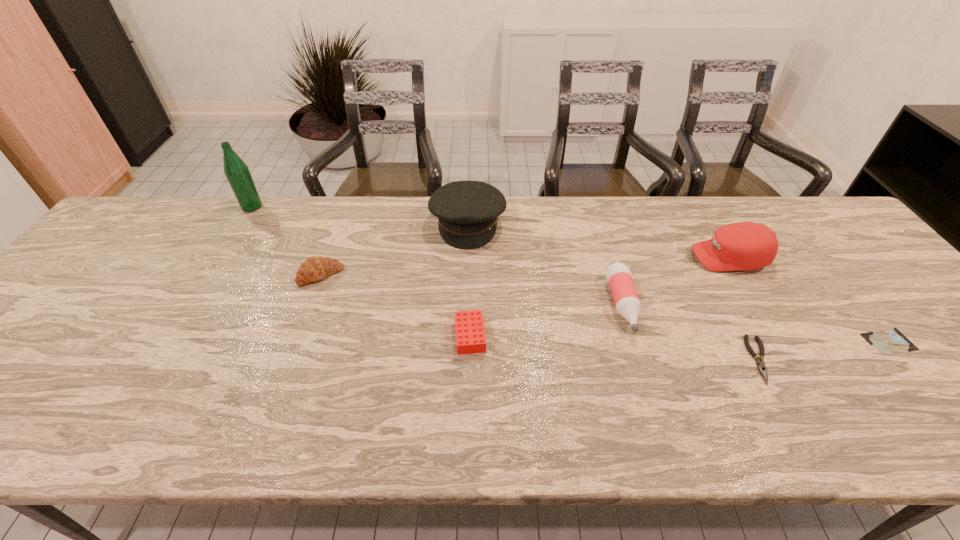
Identify the location of free space between the rightmost object and the farther bottle. Image resolution: width=960 pixels, height=540 pixels. (570, 274).

This screenshot has width=960, height=540. Find the location of `free spot between the Lego and the crescent roll`. free spot between the Lego and the crescent roll is located at coordinates (396, 306).

At what (x,y) coordinates should I click in order to perform the action: click on free space between the second object from left to right and the Lego. Please return your answer as a coordinate pair (x, y). This screenshot has width=960, height=540. Looking at the image, I should click on tap(396, 306).

At what (x,y) coordinates should I click in order to perform the action: click on vacant space in between the farther bottle and the beret. Please return your answer as a coordinate pair (x, y). Looking at the image, I should click on (360, 215).

Image resolution: width=960 pixels, height=540 pixels. Find the location of `vacant space in between the tallest object and the beret`. vacant space in between the tallest object and the beret is located at coordinates (360, 215).

Locate an element on the screen. This screenshot has width=960, height=540. free spot between the cap and the rightmost object is located at coordinates (808, 299).

This screenshot has height=540, width=960. In order to click on free spot between the farther bottle and the nearer bottle in this screenshot , I will do `click(437, 256)`.

Locate an element on the screen. This screenshot has width=960, height=540. vacant region between the identity card and the sixth tallest object is located at coordinates (679, 339).

Select which object is the closest to the fifth tallest object. Please provide its 2D coordinates. Your answer should be formatted as a tuple, i.e. [(x, y)], where the tuple contains the x and y coordinates of a point satisfying the conditions above.

[(467, 211)]

Identify the location of object that ranks as the third closest to the crescent roll. The width and height of the screenshot is (960, 540). (470, 335).